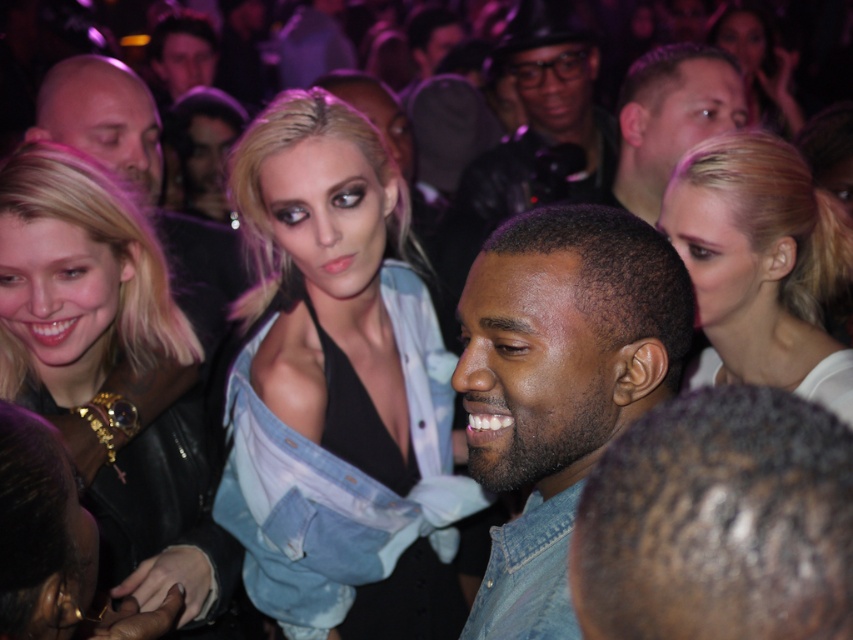
Is denim shirt at center below blonde hair at upper right?

Yes.

Based on the photo, who is more distant from viewer, (x=546, y=512) or (x=756, y=378)?

Positioned behind is point (x=756, y=378).

At what (x,y) coordinates should I click in order to perform the action: click on denim shirt at center. Please return your answer as a coordinate pair (x, y). Image resolution: width=853 pixels, height=640 pixels. Looking at the image, I should click on (560, 385).

Is denim jacket at center above matte black jacket at upper center?

Actually, denim jacket at center is below matte black jacket at upper center.

Does point (410, 433) come in front of point (781, 84)?

Yes, point (410, 433) is in front of point (781, 84).

Locate an element on the screen. The height and width of the screenshot is (640, 853). denim jacket at center is located at coordinates (335, 387).

Does point (339, 474) come behind point (82, 56)?

That is False.

Who is taller, denim jacket at center or matte black leather jacket at upper center?

Standing taller between the two is denim jacket at center.

At what (x,y) coordinates should I click in order to perform the action: click on denim jacket at center. Please return your answer as a coordinate pair (x, y). The width and height of the screenshot is (853, 640). Looking at the image, I should click on (335, 387).